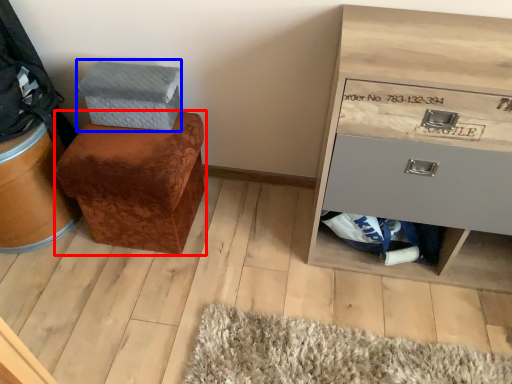
Question: Which object is closer to the camera taking this photo, furniture (highlighted by a red box) or shoe box (highlighted by a blue box)?

Choices:
 (A) furniture
 (B) shoe box

Answer: (A)